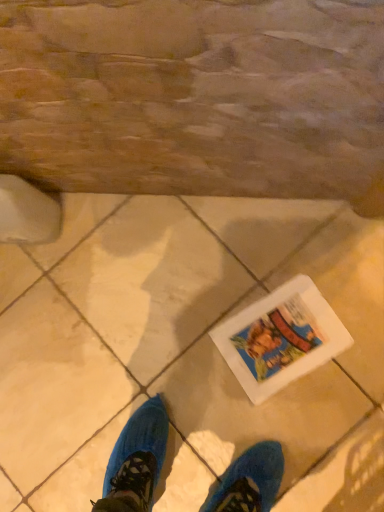
Locate an element on the screen. The height and width of the screenshot is (512, 384). vacant position to the left of white matte comic book at lower center is located at coordinates click(205, 386).